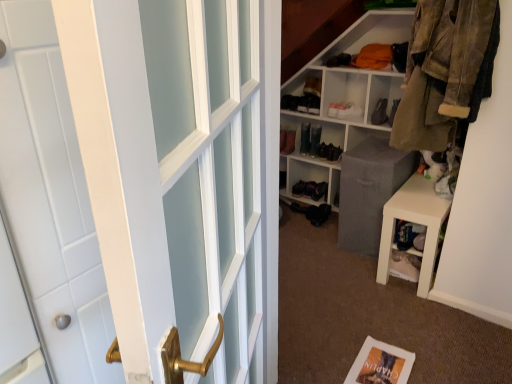
Question: Is white matte bookshelf at center a part of matte black boot at upper center, placed as the 3th shoe when sorted from left to right?

Choices:
 (A) no
 (B) yes

Answer: (A)

Question: Is matte black boot at upper center, placed as the 3th shoe when sorted from left to right, thinner than white matte bookshelf at center?

Choices:
 (A) no
 (B) yes

Answer: (A)

Question: Could you tell me if matte black boot at upper center, which ranks as the 2th shoe in right-to-left order, is facing white matte bookshelf at center?

Choices:
 (A) yes
 (B) no

Answer: (B)

Question: Does matte black boot at upper center, which ranks as the 2th shoe in right-to-left order, have a greater height compared to white matte bookshelf at center?

Choices:
 (A) yes
 (B) no

Answer: (B)

Question: Can you confirm if matte black boot at upper center, placed as the 3th shoe when sorted from left to right, is positioned to the right of white matte bookshelf at center?

Choices:
 (A) no
 (B) yes

Answer: (B)

Question: From a real-world perspective, relative to matte black boot at upper center, which ranks as the 2th shoe in right-to-left order, is camouflage fabric jacket at upper right vertically above or below?

Choices:
 (A) below
 (B) above

Answer: (B)

Question: Relative to matte black boot at upper center, which ranks as the 2th shoe in right-to-left order, is camouflage fabric jacket at upper right in front or behind?

Choices:
 (A) behind
 (B) front

Answer: (B)

Question: From the image's perspective, is camouflage fabric jacket at upper right positioned above or below matte black boot at upper center, which ranks as the 2th shoe in right-to-left order?

Choices:
 (A) below
 (B) above

Answer: (A)

Question: Is camouflage fabric jacket at upper right to the left or to the right of matte black boot at upper center, placed as the 3th shoe when sorted from left to right, in the image?

Choices:
 (A) right
 (B) left

Answer: (A)

Question: Is point (142, 243) positioned closer to the camera than point (302, 142)?

Choices:
 (A) closer
 (B) farther

Answer: (A)

Question: Considering their positions, is white glossy door handle at left located in front of or behind shiny black shoe at center, placed as the 4th shoe when sorted from right to left?

Choices:
 (A) behind
 (B) front

Answer: (B)

Question: Based on their positions, is white glossy door handle at left located to the left or right of shiny black shoe at center, which ranks as the first shoe in left-to-right order?

Choices:
 (A) right
 (B) left

Answer: (B)

Question: Is white glossy door handle at left situated inside shiny black shoe at center, placed as the 4th shoe when sorted from right to left, or outside?

Choices:
 (A) inside
 (B) outside

Answer: (B)

Question: From their relative heights in the image, would you say matte black boot at upper center, placed as the 3th shoe when sorted from left to right, is taller or shorter than camouflage fabric jacket at upper right?

Choices:
 (A) tall
 (B) short

Answer: (B)

Question: Looking at the image, does matte black boot at upper center, placed as the 3th shoe when sorted from left to right, seem bigger or smaller compared to camouflage fabric jacket at upper right?

Choices:
 (A) big
 (B) small

Answer: (B)